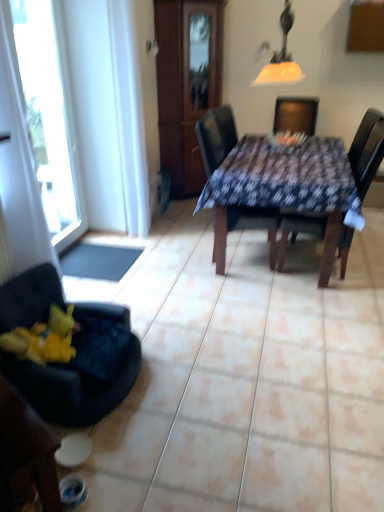
Question: Can you confirm if matte yellow glass lampshade at upper center is bigger than wooden armoire at center?

Choices:
 (A) yes
 (B) no

Answer: (B)

Question: From the image's perspective, is matte yellow glass lampshade at upper center below wooden armoire at center?

Choices:
 (A) no
 (B) yes

Answer: (B)

Question: Is matte yellow glass lampshade at upper center further to the viewer compared to wooden armoire at center?

Choices:
 (A) yes
 (B) no

Answer: (B)

Question: Is matte yellow glass lampshade at upper center positioned with its back to wooden armoire at center?

Choices:
 (A) no
 (B) yes

Answer: (A)

Question: Is matte yellow glass lampshade at upper center positioned in front of wooden armoire at center?

Choices:
 (A) yes
 (B) no

Answer: (A)

Question: Considering the positions of point [269, 68] and point [125, 257], is point [269, 68] closer or farther from the camera than point [125, 257]?

Choices:
 (A) farther
 (B) closer

Answer: (B)

Question: Considering the positions of matte yellow glass lampshade at upper center and black rubber mat at lower left in the image, is matte yellow glass lampshade at upper center wider or thinner than black rubber mat at lower left?

Choices:
 (A) wide
 (B) thin

Answer: (B)

Question: Is matte yellow glass lampshade at upper center taller or shorter than black rubber mat at lower left?

Choices:
 (A) short
 (B) tall

Answer: (B)

Question: From a real-world perspective, is matte yellow glass lampshade at upper center physically located above or below black rubber mat at lower left?

Choices:
 (A) below
 (B) above

Answer: (B)

Question: In terms of height, does matte yellow glass lampshade at upper center look taller or shorter compared to velvet dark blue chair at lower left, placed as the first chair when sorted from left to right?

Choices:
 (A) short
 (B) tall

Answer: (B)

Question: Considering the relative positions of matte yellow glass lampshade at upper center and velvet dark blue chair at lower left, placed as the first chair when sorted from left to right, in the image provided, is matte yellow glass lampshade at upper center to the left or to the right of velvet dark blue chair at lower left, placed as the first chair when sorted from left to right,?

Choices:
 (A) right
 (B) left

Answer: (A)

Question: From a real-world perspective, is matte yellow glass lampshade at upper center physically located above or below velvet dark blue chair at lower left, the fourth chair in the right-to-left sequence?

Choices:
 (A) above
 (B) below

Answer: (A)

Question: Relative to velvet dark blue chair at lower left, the fourth chair in the right-to-left sequence, is matte yellow glass lampshade at upper center in front or behind?

Choices:
 (A) behind
 (B) front

Answer: (A)

Question: From their relative heights in the image, would you say velvet dark blue chair at lower left, the fourth chair in the right-to-left sequence, is taller or shorter than wooden armoire at center?

Choices:
 (A) tall
 (B) short

Answer: (B)

Question: From the image's perspective, is velvet dark blue chair at lower left, placed as the first chair when sorted from left to right, above or below wooden armoire at center?

Choices:
 (A) below
 (B) above

Answer: (A)